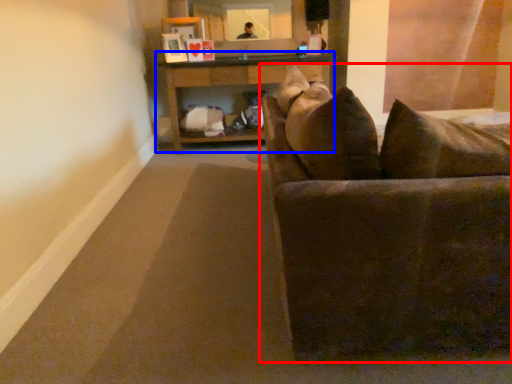
Question: Which of the following is the closest to the observer, studio couch (highlighted by a red box) or table (highlighted by a blue box)?

Choices:
 (A) studio couch
 (B) table

Answer: (A)